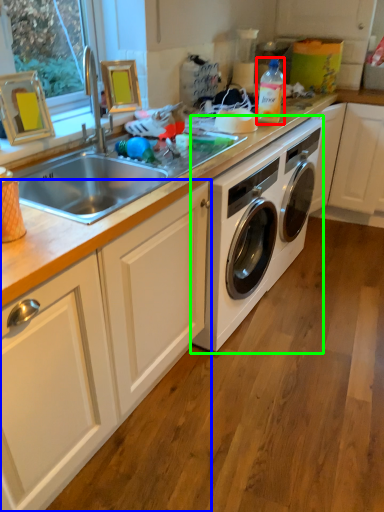
Question: Which object is positioned closest to bottle (highlighted by a red box)? Select from cabinetry (highlighted by a blue box) and washing machine (highlighted by a green box).

Choices:
 (A) cabinetry
 (B) washing machine

Answer: (B)